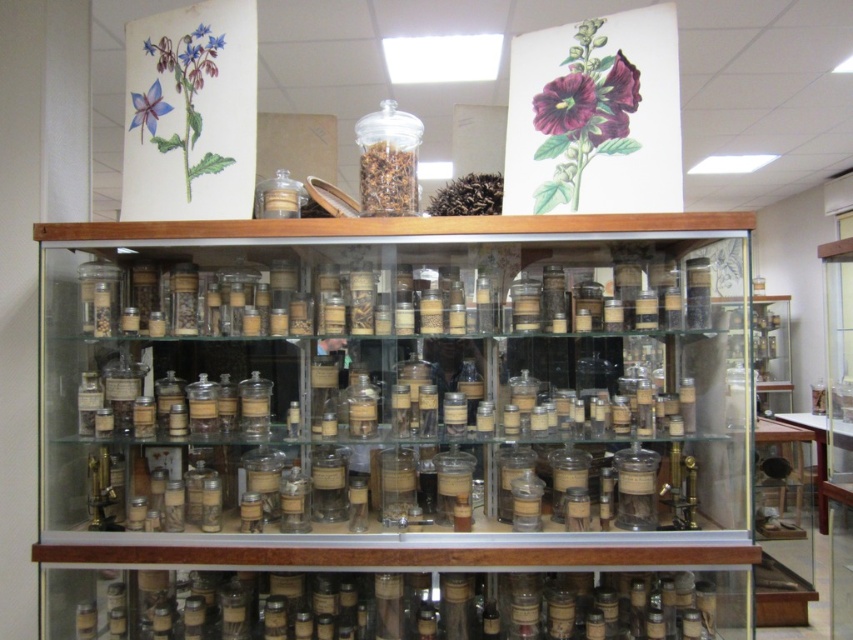
Question: Which point is farther to the camera?

Choices:
 (A) (554, 564)
 (B) (370, 147)

Answer: (B)

Question: In this image, where is clear glass jars at center located relative to transparent glass jar at center?

Choices:
 (A) above
 (B) below

Answer: (B)

Question: Which point appears closest to the camera in this image?

Choices:
 (A) (401, 209)
 (B) (573, 621)

Answer: (A)

Question: Observing the image, what is the correct spatial positioning of clear glass jars at center in reference to transparent glass jar at center?

Choices:
 (A) left
 (B) right

Answer: (B)

Question: Is clear glass jars at center wider than transparent glass jar at center?

Choices:
 (A) yes
 (B) no

Answer: (A)